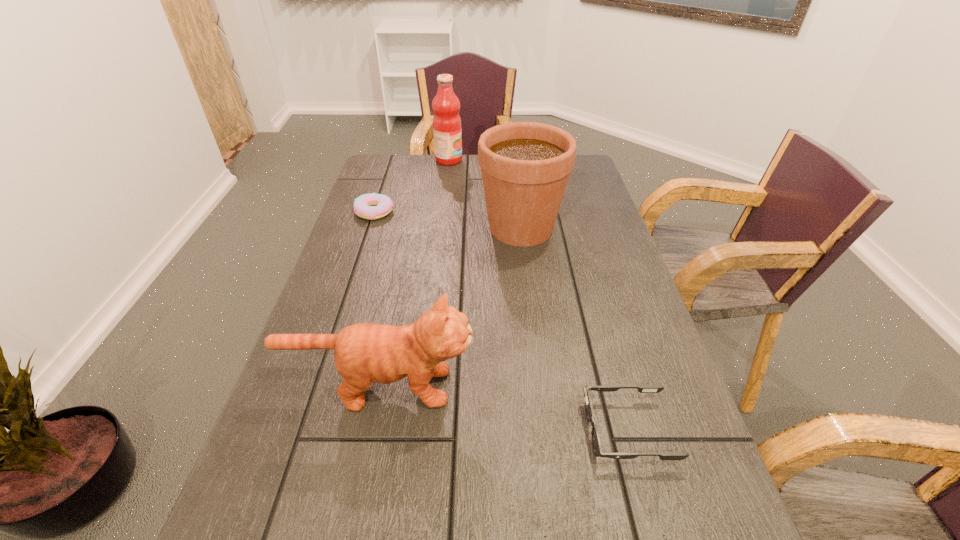
Where is `empty space that is in between the fruit juice and the cat`? This screenshot has height=540, width=960. empty space that is in between the fruit juice and the cat is located at coordinates 414,273.

Find the location of a particular element. free point between the doughnut and the sunglasses is located at coordinates (501, 321).

What are the coordinates of `free area in between the farthest object and the doughnut` in the screenshot? It's located at (412, 186).

Locate an element on the screen. This screenshot has height=540, width=960. free area in between the doughnut and the sunglasses is located at coordinates (501, 321).

Locate an element on the screen. This screenshot has height=540, width=960. blank region between the sunglasses and the doughnut is located at coordinates (501, 321).

This screenshot has height=540, width=960. Find the location of `empty location between the doughnut and the sunglasses`. empty location between the doughnut and the sunglasses is located at coordinates (501, 321).

Image resolution: width=960 pixels, height=540 pixels. I want to click on object that stands as the fourth closest to the cat, so click(447, 131).

The image size is (960, 540). I want to click on object that is the closest one to the flowerpot, so click(x=370, y=206).

The width and height of the screenshot is (960, 540). What are the coordinates of `free space that satisfies the following two spatial constraints: 1. on the front label of the fruit juice; 2. on the right side of the flowerpot` in the screenshot? It's located at (x=441, y=228).

Locate an element on the screen. This screenshot has height=540, width=960. free spot that satisfies the following two spatial constraints: 1. on the front label of the flowerpot; 2. on the left side of the fruit juice is located at coordinates [441, 228].